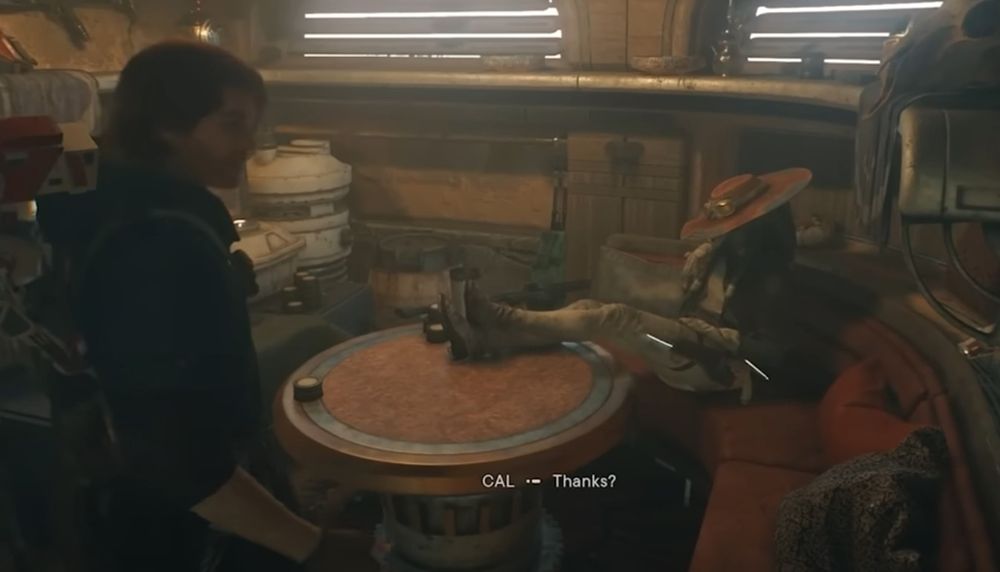
Locate an element on the screen. The height and width of the screenshot is (572, 1000). teapot is located at coordinates (735, 65).